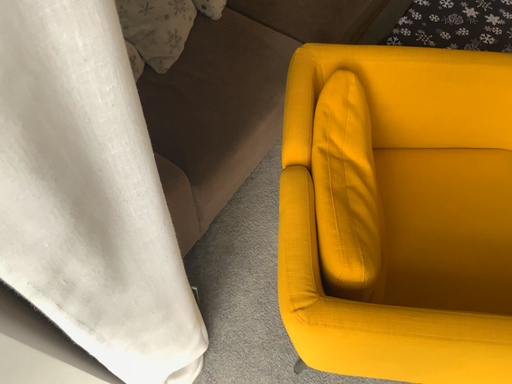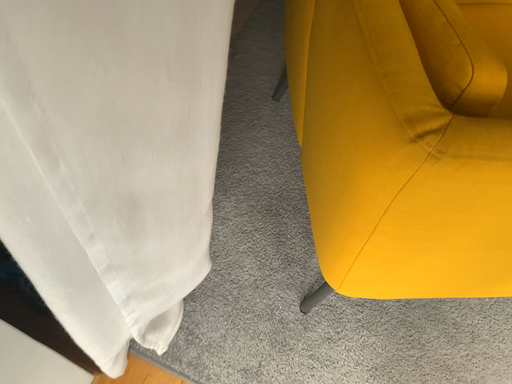
Question: How did the camera likely rotate when shooting the video?

Choices:
 (A) rotated left
 (B) rotated right

Answer: (B)